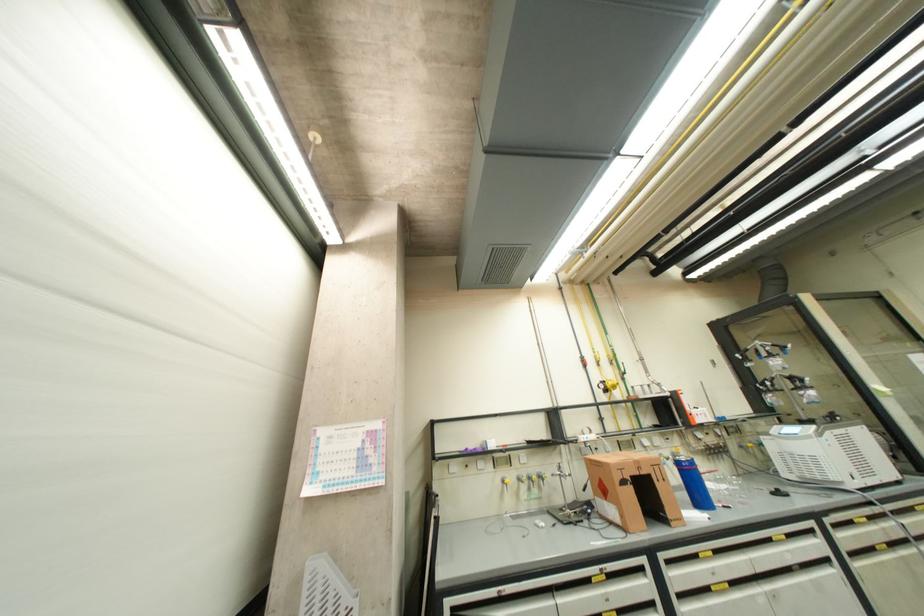
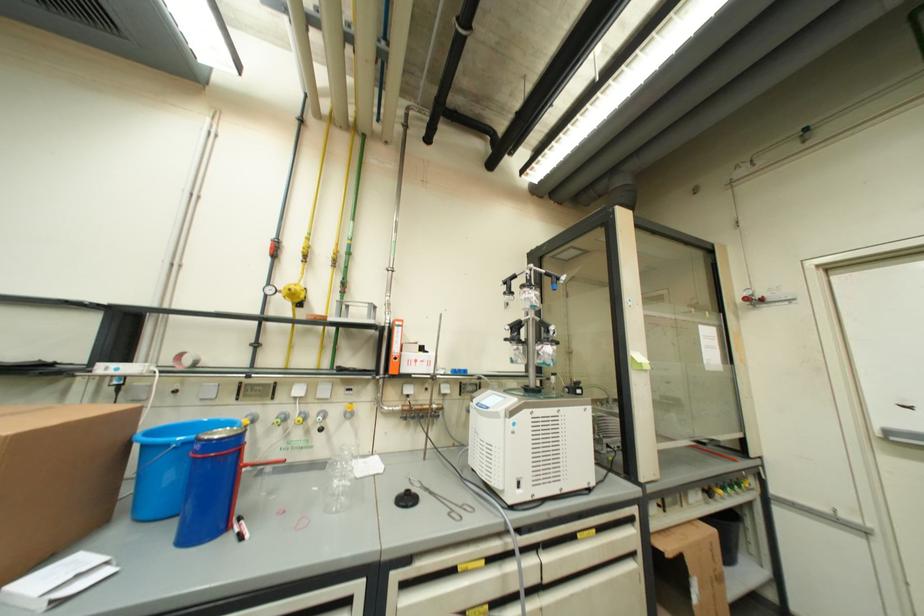
What movement of the cameraman would produce the second image?

The cameraman walked toward right, forward.